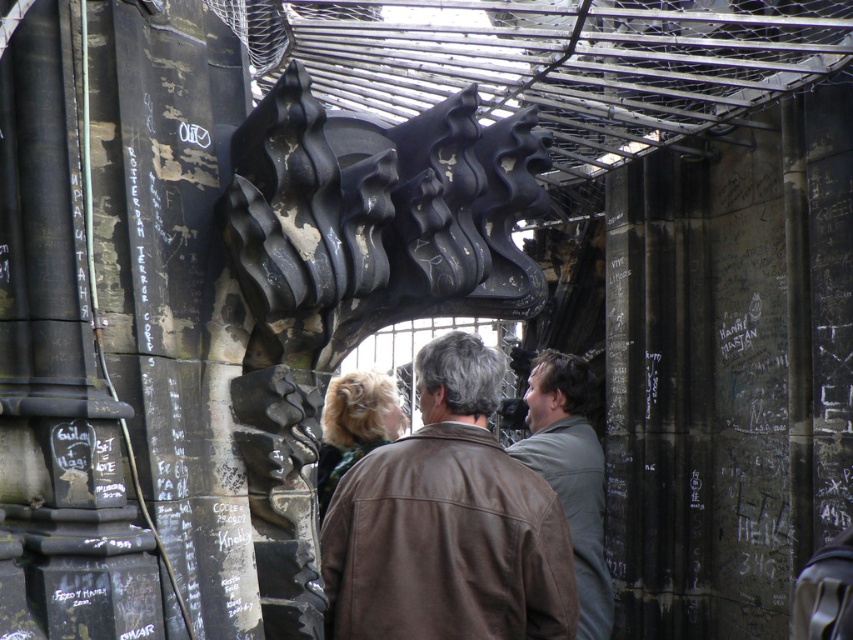
You are standing in the industrial space and notice two jackets hanging on the wall. Which jacket is positioned to the left when looking at the brown leather jacket at center and the green matte jacket at center?

The brown leather jacket at center is positioned to the left of the green matte jacket at center.

You are an interior designer assessing the space. You notice the black matte sculpture at center and the brown leather jacket at center. Which object is taller?

The black matte sculpture at center is taller than the brown leather jacket at center.